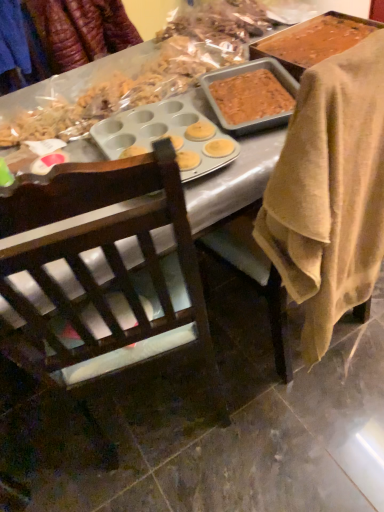
In order to face brown wooden chair at center, marked as the first chair in a right-to-left arrangement, should I rotate leftwards or rightwards?

A 15.085 degree turn to the right will do.

Find the location of a particular element. This screenshot has height=512, width=384. dark wood chair at center, which is counted as the 2th chair, starting from the right is located at coordinates (105, 257).

Identify the location of blue fabric at upper left. Image resolution: width=384 pixels, height=512 pixels. (13, 39).

Where is `brown wooden chair at center, marked as the first chair in a right-to-left arrangement`? Image resolution: width=384 pixels, height=512 pixels. brown wooden chair at center, marked as the first chair in a right-to-left arrangement is located at coordinates (282, 218).

From the picture: From a real-world perspective, which is physically below, brown wooden chair at center, marked as the first chair in a right-to-left arrangement, or blue fabric at upper left?

brown wooden chair at center, marked as the first chair in a right-to-left arrangement, is physically lower.

Considering the relative positions of brown wooden chair at center, marked as the first chair in a right-to-left arrangement, and blue fabric at upper left in the image provided, is brown wooden chair at center, marked as the first chair in a right-to-left arrangement, in front of blue fabric at upper left?

Yes, brown wooden chair at center, marked as the first chair in a right-to-left arrangement, is in front of blue fabric at upper left.

From the image's perspective, is brown wooden chair at center, which is counted as the second chair, starting from the left, above blue fabric at upper left?

No, from the image's perspective, brown wooden chair at center, which is counted as the second chair, starting from the left, is not on top of blue fabric at upper left.

Measure the distance from brown wooden chair at center, marked as the first chair in a right-to-left arrangement, to blue fabric at upper left.

The distance of brown wooden chair at center, marked as the first chair in a right-to-left arrangement, from blue fabric at upper left is 1.45 meters.

From the picture: Does brown wooden chair at center, which is counted as the second chair, starting from the left, lie behind dark wood chair at center, which is counted as the 2th chair, starting from the right?

Yes, brown wooden chair at center, which is counted as the second chair, starting from the left, is behind dark wood chair at center, which is counted as the 2th chair, starting from the right.

Could you tell me if brown wooden chair at center, marked as the first chair in a right-to-left arrangement, is turned towards dark wood chair at center, arranged as the first chair when viewed from the left?

No, brown wooden chair at center, marked as the first chair in a right-to-left arrangement, is not oriented towards dark wood chair at center, arranged as the first chair when viewed from the left.

Considering the relative positions of brown wooden chair at center, which is counted as the second chair, starting from the left, and dark wood chair at center, arranged as the first chair when viewed from the left, in the image provided, is brown wooden chair at center, which is counted as the second chair, starting from the left, to the left or to the right of dark wood chair at center, arranged as the first chair when viewed from the left,?

Based on their positions, brown wooden chair at center, which is counted as the second chair, starting from the left, is located to the right of dark wood chair at center, arranged as the first chair when viewed from the left.

In the image, is dark wood chair at center, which is counted as the 2th chair, starting from the right, positioned in front of or behind blue fabric at upper left?

Visually, dark wood chair at center, which is counted as the 2th chair, starting from the right, is located in front of blue fabric at upper left.

From a real-world perspective, between dark wood chair at center, arranged as the first chair when viewed from the left, and blue fabric at upper left, who is vertically lower?

dark wood chair at center, arranged as the first chair when viewed from the left, from a real-world perspective.

Is dark wood chair at center, which is counted as the 2th chair, starting from the right, positioned beyond the bounds of blue fabric at upper left?

Yes, dark wood chair at center, which is counted as the 2th chair, starting from the right, is not within blue fabric at upper left.

How far apart are dark wood chair at center, which is counted as the 2th chair, starting from the right, and blue fabric at upper left?

dark wood chair at center, which is counted as the 2th chair, starting from the right, is 4.82 feet from blue fabric at upper left.

Locate an element on the screen. clothing behind the brown wooden chair at center, which is counted as the second chair, starting from the left is located at coordinates (13, 39).

Consider the image. Which is nearer, (11, 11) or (279, 361)?

Point (11, 11) is farther from the camera than point (279, 361).

Based on their sizes in the image, would you say blue fabric at upper left is bigger or smaller than brown wooden chair at center, marked as the first chair in a right-to-left arrangement?

Considering their sizes, blue fabric at upper left takes up less space than brown wooden chair at center, marked as the first chair in a right-to-left arrangement.

Does blue fabric at upper left have a smaller size compared to dark wood chair at center, which is counted as the 2th chair, starting from the right?

Correct, blue fabric at upper left occupies less space than dark wood chair at center, which is counted as the 2th chair, starting from the right.

Consider the image. Does blue fabric at upper left have a greater width compared to dark wood chair at center, arranged as the first chair when viewed from the left?

In fact, blue fabric at upper left might be narrower than dark wood chair at center, arranged as the first chair when viewed from the left.

From the image's perspective, between blue fabric at upper left and dark wood chair at center, which is counted as the 2th chair, starting from the right, who is located below?

From the image's view, dark wood chair at center, which is counted as the 2th chair, starting from the right, is below.

From a real-world perspective, between blue fabric at upper left and dark wood chair at center, which is counted as the 2th chair, starting from the right, who is vertically lower?

dark wood chair at center, which is counted as the 2th chair, starting from the right, is physically lower.

Considering the sizes of objects dark wood chair at center, which is counted as the 2th chair, starting from the right, and brown wooden chair at center, which is counted as the second chair, starting from the left, in the image provided, who is thinner, dark wood chair at center, which is counted as the 2th chair, starting from the right, or brown wooden chair at center, which is counted as the second chair, starting from the left,?

brown wooden chair at center, which is counted as the second chair, starting from the left.

Which is in front, dark wood chair at center, which is counted as the 2th chair, starting from the right, or brown wooden chair at center, which is counted as the second chair, starting from the left?

dark wood chair at center, which is counted as the 2th chair, starting from the right, is in front.

From a real-world perspective, is dark wood chair at center, which is counted as the 2th chair, starting from the right, above or below brown wooden chair at center, marked as the first chair in a right-to-left arrangement?

In terms of real-world spatial position, dark wood chair at center, which is counted as the 2th chair, starting from the right, is below brown wooden chair at center, marked as the first chair in a right-to-left arrangement.

Is dark wood chair at center, arranged as the first chair when viewed from the left, taller or shorter than brown wooden chair at center, which is counted as the second chair, starting from the left?

Clearly, dark wood chair at center, arranged as the first chair when viewed from the left, is shorter compared to brown wooden chair at center, which is counted as the second chair, starting from the left.

From the image's perspective, count 1st chairs downward from the blue fabric at upper left and point to it. Please provide its 2D coordinates.

[(282, 218)]

At what (x,y) coordinates should I click in order to perform the action: click on chair above the dark wood chair at center, arranged as the first chair when viewed from the left (from the image's perspective). Please return your answer as a coordinate pair (x, y). The height and width of the screenshot is (512, 384). Looking at the image, I should click on (282, 218).

From the image, which object appears to be nearer to dark wood chair at center, arranged as the first chair when viewed from the left, brown wooden chair at center, marked as the first chair in a right-to-left arrangement, or blue fabric at upper left?

brown wooden chair at center, marked as the first chair in a right-to-left arrangement, is positioned closer to the anchor dark wood chair at center, arranged as the first chair when viewed from the left.

Looking at this image, estimate the real-world distances between objects in this image. Which object is closer to brown wooden chair at center, which is counted as the second chair, starting from the left, blue fabric at upper left or dark wood chair at center, which is counted as the 2th chair, starting from the right?

Among the two, dark wood chair at center, which is counted as the 2th chair, starting from the right, is located nearer to brown wooden chair at center, which is counted as the second chair, starting from the left.

Looking at the image, which one is located further to blue fabric at upper left, dark wood chair at center, which is counted as the 2th chair, starting from the right, or brown wooden chair at center, which is counted as the second chair, starting from the left?

dark wood chair at center, which is counted as the 2th chair, starting from the right, is further to blue fabric at upper left.

When comparing their distances from blue fabric at upper left, does brown wooden chair at center, marked as the first chair in a right-to-left arrangement, or dark wood chair at center, which is counted as the 2th chair, starting from the right, seem further?

dark wood chair at center, which is counted as the 2th chair, starting from the right, is further to blue fabric at upper left.

Which object lies nearer to the anchor point dark wood chair at center, which is counted as the 2th chair, starting from the right, blue fabric at upper left or brown wooden chair at center, marked as the first chair in a right-to-left arrangement?

The object closer to dark wood chair at center, which is counted as the 2th chair, starting from the right, is brown wooden chair at center, marked as the first chair in a right-to-left arrangement.

In the scene shown: Which object lies nearer to the anchor point brown wooden chair at center, marked as the first chair in a right-to-left arrangement, dark wood chair at center, arranged as the first chair when viewed from the left, or blue fabric at upper left?

dark wood chair at center, arranged as the first chair when viewed from the left, is closer to brown wooden chair at center, marked as the first chair in a right-to-left arrangement.

Locate an element on the screen. chair located between dark wood chair at center, which is counted as the 2th chair, starting from the right, and blue fabric at upper left in the depth direction is located at coordinates (282, 218).